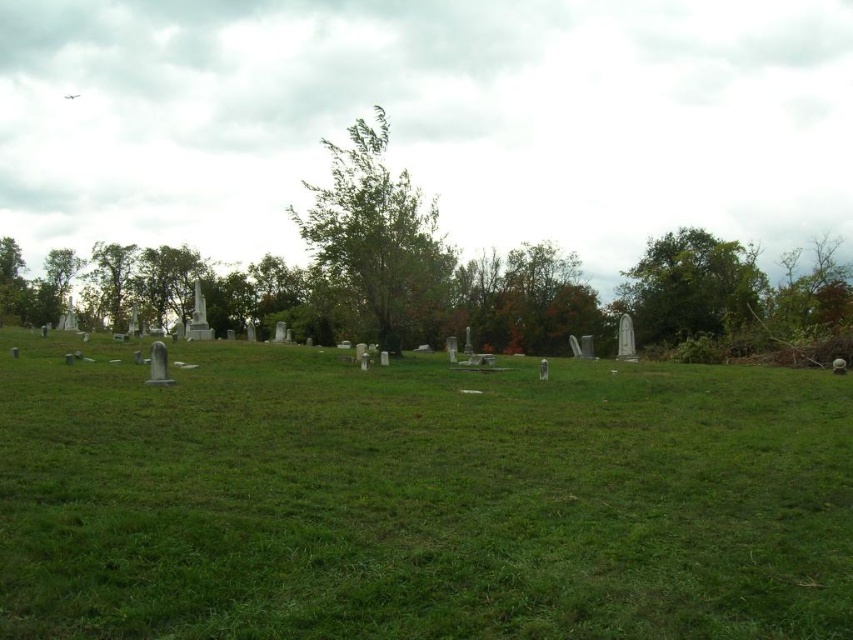
You are standing at the center of the cemetery looking towards the trees in the midground. You see a point marked at coordinates [691,285]. What object does this point correspond to?

The point at coordinates [691,285] corresponds to the green leafy tree at upper right.

You are a gardener standing on the green grassy field at center. You want to walk to the green leafy tree at left. Which direction should you move to reach it?

The green grassy field at center is in front of green leafy tree at left, so you should move backward to reach the green leafy tree at left.

You are standing at the center of the cemetery and want to place a new gravestone on the green grassy field at center. According to the coordinates provided, where exactly should you place it?

The green grassy field at center is located at point (418, 499), so you should place the new gravestone at those coordinates to ensure it is on the green grassy field at center.